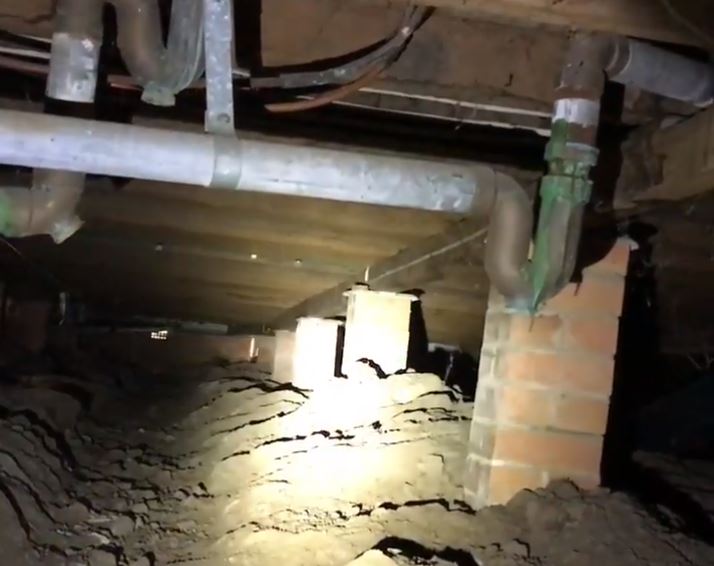
Locate an element on the screen. The height and width of the screenshot is (566, 714). space under floorboards is located at coordinates (196, 330).